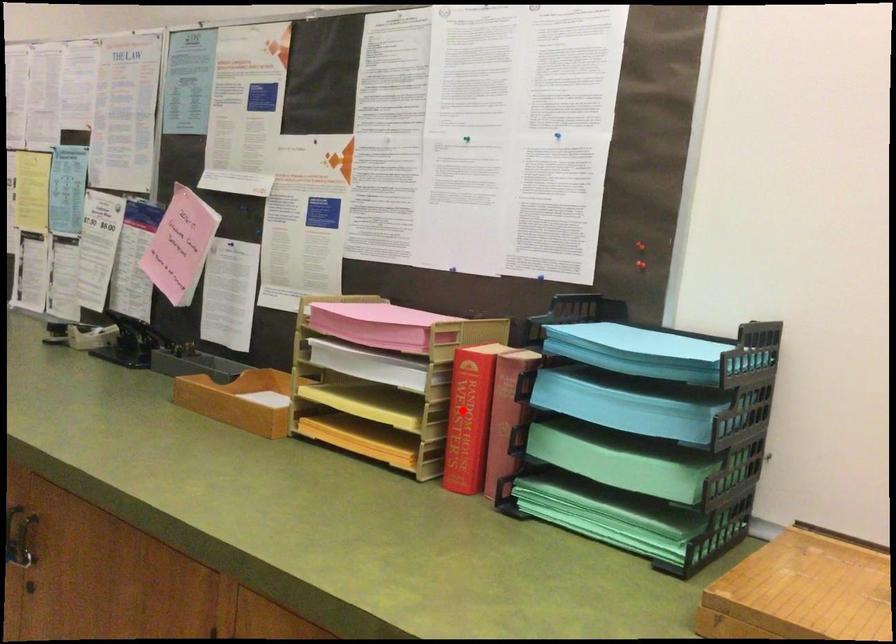
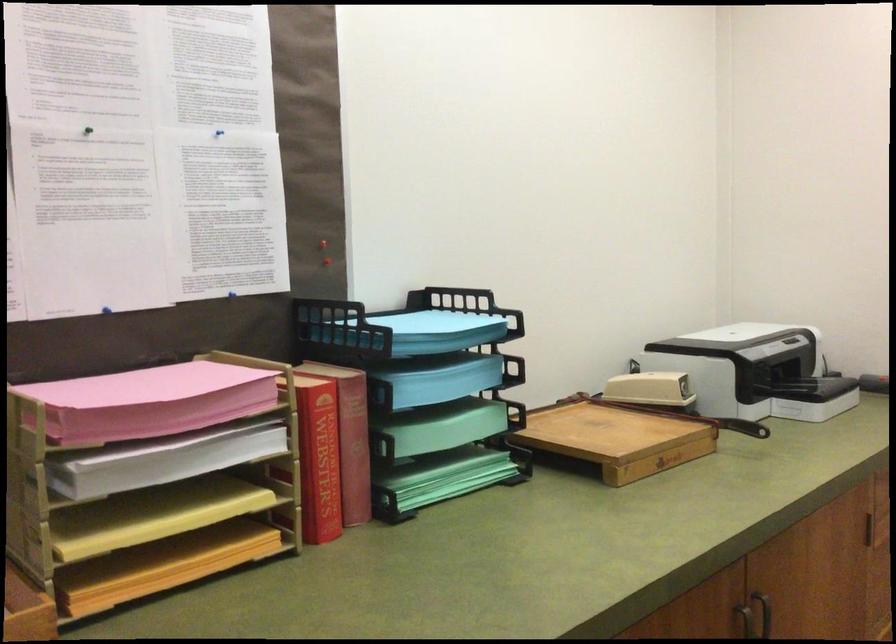
Question: A red point is marked in image1. In image2, is the corresponding 3D point closer to the camera or farther? Reply with the corresponding letter.

Choices:
 (A) The corresponding 3D point is closer.
 (B) The corresponding 3D point is farther.

Answer: (A)